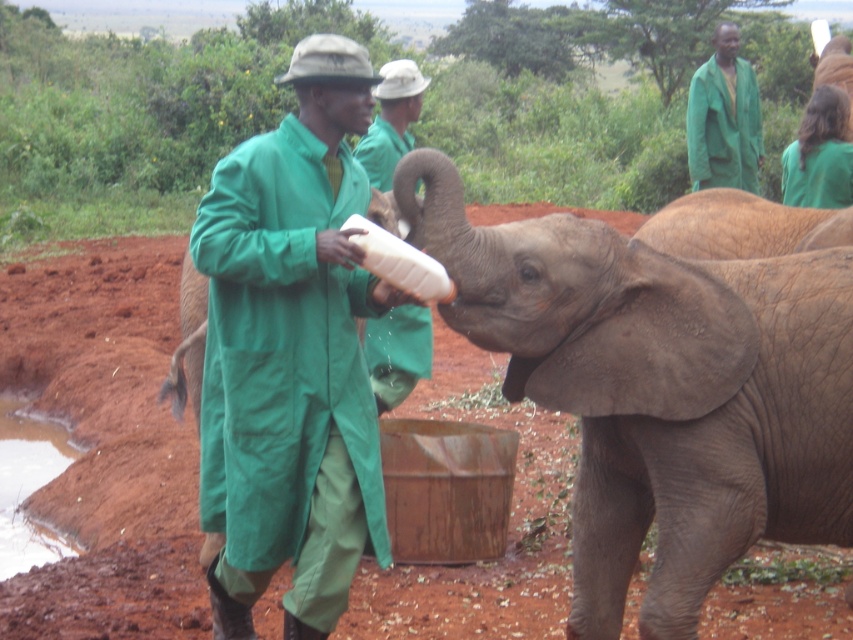
You are standing in the savanna and see two points in the image. Which point is nearer to you, point (251, 234) or point (711, 145)?

Point (251, 234) is closer to the viewer than point (711, 145).

You are a wildlife photographer standing at the edge of the savanna. You want to take a photo of the baby elephant while ensuring both the green fabric coat at center and the green fabric coat at upper right are visible in the frame. Given their distance apart, do you think you can fit both into your camera viewfinder without moving your position?

The green fabric coat at center and the green fabric coat at upper right are 17.67 feet apart. Since the distance between them is relatively large, you might need to adjust your camera settings or zoom out to ensure both are visible in the frame without moving your position.